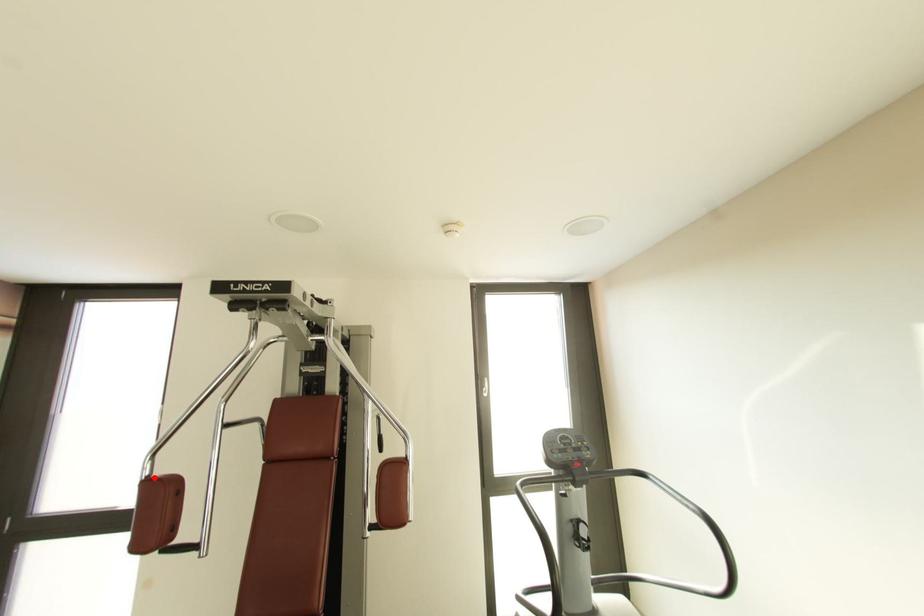
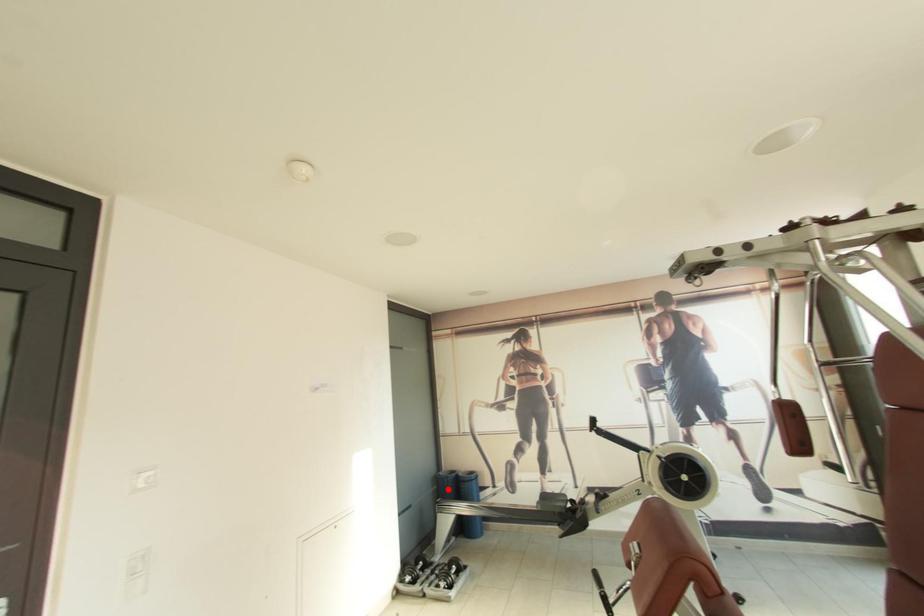
I am providing you with two images of the same scene from different viewpoints. A red point is marked on the first image and another point is marked on the second image. Is the marked point in image1 the same physical position as the marked point in image2?

No